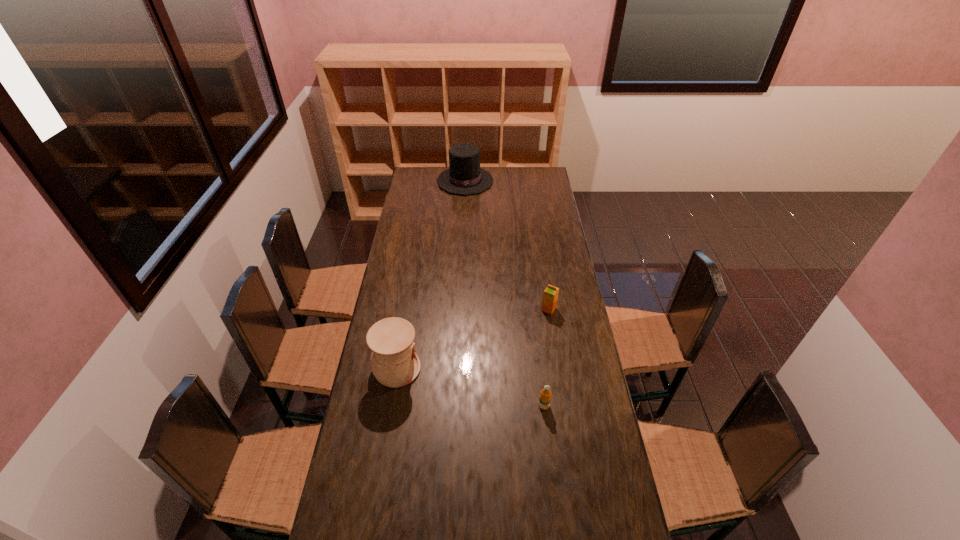
The width and height of the screenshot is (960, 540). What are the coordinates of `object that is at the far edge` in the screenshot? It's located at 464,177.

The height and width of the screenshot is (540, 960). I want to click on dress hat at the left edge, so click(464, 177).

The height and width of the screenshot is (540, 960). In order to click on pottery that is at the left edge in this screenshot , I will do `click(394, 362)`.

Image resolution: width=960 pixels, height=540 pixels. In order to click on object situated at the right edge in this screenshot , I will do `click(550, 296)`.

The image size is (960, 540). Identify the location of object at the far left corner. (464, 177).

The image size is (960, 540). What are the coordinates of `vacant space at the left edge of the desktop` in the screenshot? It's located at (387, 310).

This screenshot has width=960, height=540. Find the location of `free space at the right edge of the desktop`. free space at the right edge of the desktop is located at coordinates (593, 366).

In the image, there is a desktop. Where is `vacant space at the far right corner`? Image resolution: width=960 pixels, height=540 pixels. vacant space at the far right corner is located at coordinates (526, 182).

Where is `free space between the dress hat and the pottery`? Image resolution: width=960 pixels, height=540 pixels. free space between the dress hat and the pottery is located at coordinates (431, 275).

Image resolution: width=960 pixels, height=540 pixels. Find the location of `unoccupied position between the farthest object and the pottery`. unoccupied position between the farthest object and the pottery is located at coordinates click(x=431, y=275).